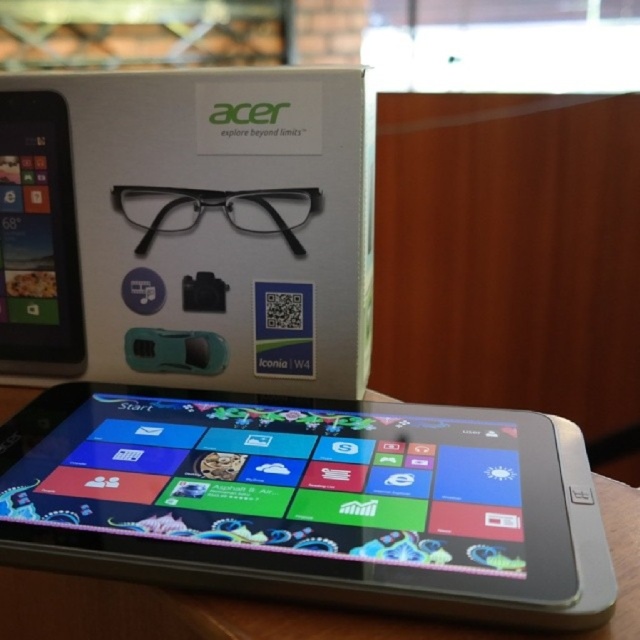
You are looking at the tablet and its packaging box. There are two points marked on the image at coordinates point [205,170] and point [45,131]. Which of these points is nearer to you?

Point [205,170] is closer to the camera than point [45,131].

You are a delivery person who needs to place two tablets into a storage container. The container can only accommodate items with a combined length of 20 inches. Given the silver metallic tablet at center and the matte black tablet at left, can both tablets fit side by side in the container?

The distance between the silver metallic tablet at center and the matte black tablet at left is 11.86 inches. Since the combined length required is 11.86 inches, which is less than the container limit of 20 inches, both tablets can fit side by side in the container.

You are trying to determine the spatial relationship between the silver metallic tablet at center and the white matte box at upper center. Which object is positioned closer to you?

The silver metallic tablet at center is closer to the viewer than the white matte box at upper center.